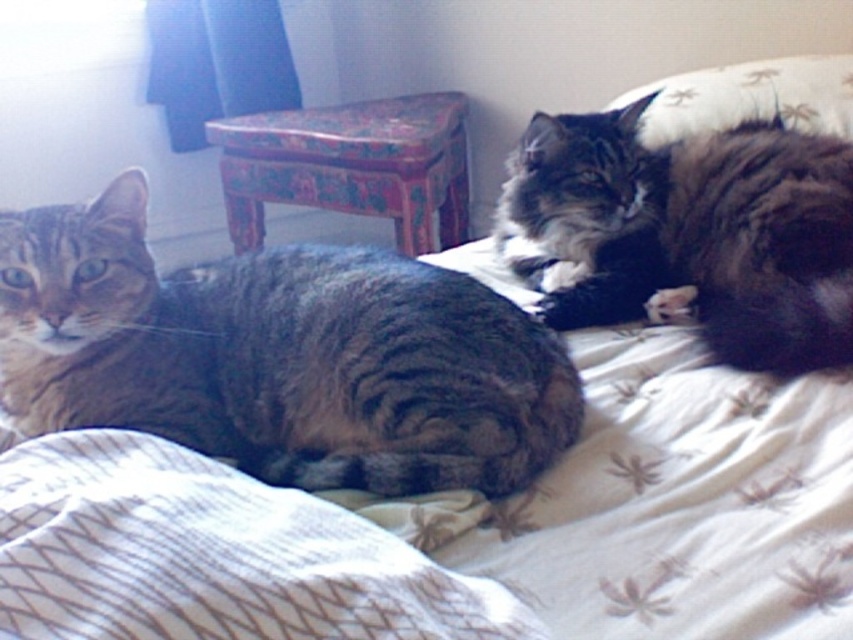
Question: Does tabby fur cat at left have a smaller size compared to white textured blanket at lower left?

Choices:
 (A) yes
 (B) no

Answer: (B)

Question: Does dark brown fur at upper right appear on the right side of wooden painted stool at center?

Choices:
 (A) yes
 (B) no

Answer: (A)

Question: Which point appears farthest from the camera in this image?

Choices:
 (A) (367, 476)
 (B) (393, 205)
 (C) (752, 337)

Answer: (B)

Question: Considering the real-world distances, which object is closest to the wooden painted stool at center?

Choices:
 (A) dark brown fur at upper right
 (B) white textured blanket at lower left

Answer: (A)

Question: Does tabby fur cat at left appear on the right side of wooden painted stool at center?

Choices:
 (A) no
 (B) yes

Answer: (A)

Question: Among these objects, which one is farthest from the camera?

Choices:
 (A) wooden painted stool at center
 (B) white textured blanket at lower left
 (C) dark brown fur at upper right
 (D) tabby fur cat at left

Answer: (A)